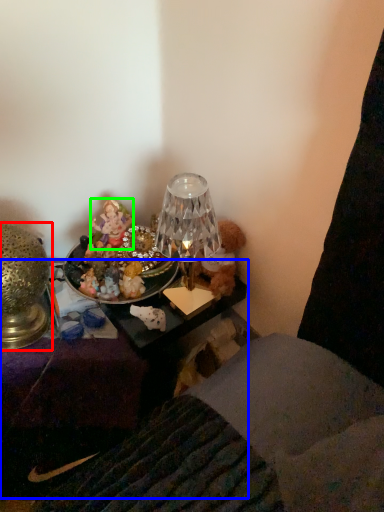
Question: Which object is positioned closest to lamp (highlighted by a red box)? Select from furniture (highlighted by a blue box) and person (highlighted by a green box).

Choices:
 (A) furniture
 (B) person

Answer: (B)